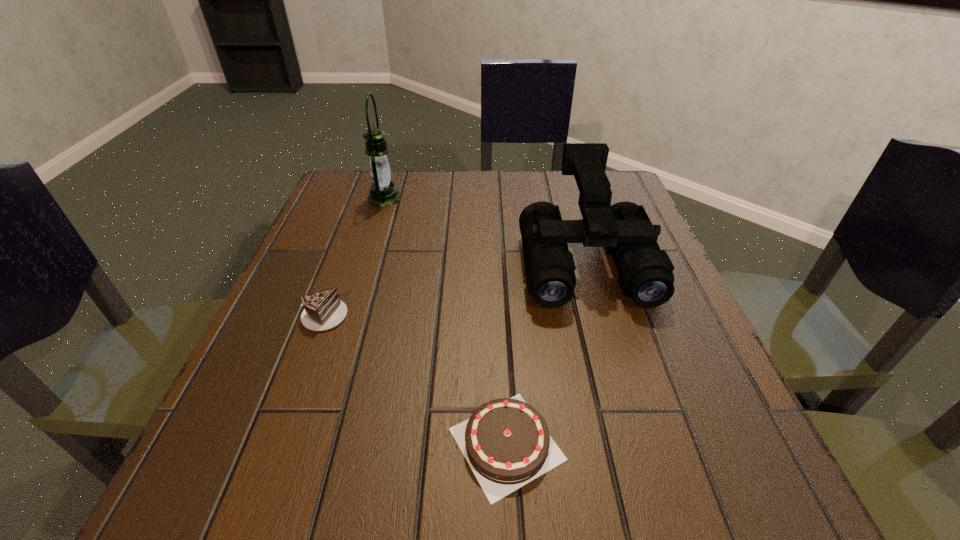
Identify the location of lantern. (383, 193).

Find the location of a particular element. The height and width of the screenshot is (540, 960). the tallest object is located at coordinates (383, 193).

Where is `the second tallest object`? The width and height of the screenshot is (960, 540). the second tallest object is located at coordinates (645, 271).

Find the location of a particular element. the farther chocolate cake is located at coordinates (324, 310).

Find the location of a particular element. Image resolution: width=960 pixels, height=540 pixels. the left chocolate cake is located at coordinates pyautogui.click(x=324, y=310).

Where is `the shortest object`? This screenshot has height=540, width=960. the shortest object is located at coordinates (506, 442).

The image size is (960, 540). In order to click on the nearest object in this screenshot , I will do `click(506, 442)`.

Locate an element on the screen. vacant area situated 0.360m on the side where the tallest object emits light is located at coordinates click(x=551, y=198).

Locate an element on the screen. The width and height of the screenshot is (960, 540). free space located on the front lenses of the binoculars is located at coordinates (605, 333).

Locate an element on the screen. The image size is (960, 540). free region located on the right of the third tallest object is located at coordinates click(x=382, y=314).